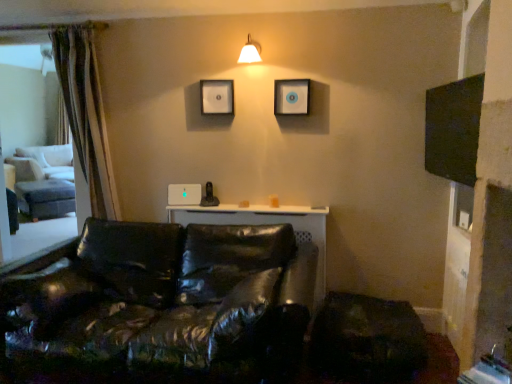
Question: Does matte black picture frame at upper center, which is the 1th picture frame in right-to-left order, have a lesser height compared to black leather couch at lower left?

Choices:
 (A) no
 (B) yes

Answer: (B)

Question: From a real-world perspective, is matte black picture frame at upper center, which is the 1th picture frame in right-to-left order, over black leather couch at lower left?

Choices:
 (A) yes
 (B) no

Answer: (A)

Question: Can we say matte black picture frame at upper center, placed as the second picture frame when sorted from left to right, lies outside black leather couch at lower left?

Choices:
 (A) no
 (B) yes

Answer: (B)

Question: From the image's perspective, would you say matte black picture frame at upper center, which is the 1th picture frame in right-to-left order, is shown under black leather couch at lower left?

Choices:
 (A) yes
 (B) no

Answer: (B)

Question: From the image's perspective, is matte black picture frame at upper center, placed as the second picture frame when sorted from left to right, on top of black leather couch at lower left?

Choices:
 (A) no
 (B) yes

Answer: (B)

Question: Is matte black picture frame at upper center, which is the 1th picture frame in right-to-left order, oriented towards black leather couch at lower left?

Choices:
 (A) no
 (B) yes

Answer: (A)

Question: Is white glossy wall lamp at upper center completely or partially inside black leather couch at lower left?

Choices:
 (A) yes
 (B) no

Answer: (B)

Question: Is black leather couch at lower left closer to camera compared to white glossy wall lamp at upper center?

Choices:
 (A) yes
 (B) no

Answer: (A)

Question: From the image's perspective, is black leather couch at lower left over white glossy wall lamp at upper center?

Choices:
 (A) no
 (B) yes

Answer: (A)

Question: Considering the relative sizes of black leather couch at lower left and white glossy wall lamp at upper center in the image provided, is black leather couch at lower left shorter than white glossy wall lamp at upper center?

Choices:
 (A) yes
 (B) no

Answer: (B)

Question: Does black leather couch at lower left have a smaller size compared to white glossy wall lamp at upper center?

Choices:
 (A) no
 (B) yes

Answer: (A)

Question: Can you confirm if black leather couch at lower left is positioned to the left of white glossy wall lamp at upper center?

Choices:
 (A) no
 (B) yes

Answer: (B)

Question: Is matte black picture frame at upper center, placed as the second picture frame when sorted from left to right, positioned before matte black picture frame at upper center, arranged as the 1th picture frame when viewed from the left?

Choices:
 (A) no
 (B) yes

Answer: (B)